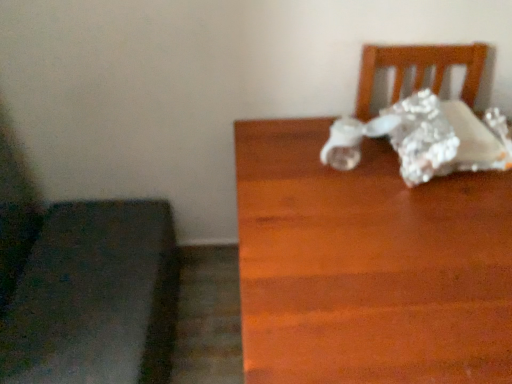
Question: In terms of size, does wooden table at right appear bigger or smaller than dark gray fabric cushion at lower left?

Choices:
 (A) big
 (B) small

Answer: (A)

Question: Relative to dark gray fabric cushion at lower left, is wooden table at right in front or behind?

Choices:
 (A) behind
 (B) front

Answer: (B)

Question: From a real-world perspective, is wooden table at right positioned above or below dark gray fabric cushion at lower left?

Choices:
 (A) below
 (B) above

Answer: (B)

Question: Based on their sizes in the image, would you say dark gray fabric cushion at lower left is bigger or smaller than wooden table at right?

Choices:
 (A) big
 (B) small

Answer: (B)

Question: From their relative heights in the image, would you say dark gray fabric cushion at lower left is taller or shorter than wooden table at right?

Choices:
 (A) short
 (B) tall

Answer: (A)

Question: Would you say dark gray fabric cushion at lower left is inside or outside wooden table at right?

Choices:
 (A) inside
 (B) outside

Answer: (B)

Question: Considering the positions of point (72, 263) and point (433, 319), is point (72, 263) closer or farther from the camera than point (433, 319)?

Choices:
 (A) closer
 (B) farther

Answer: (B)